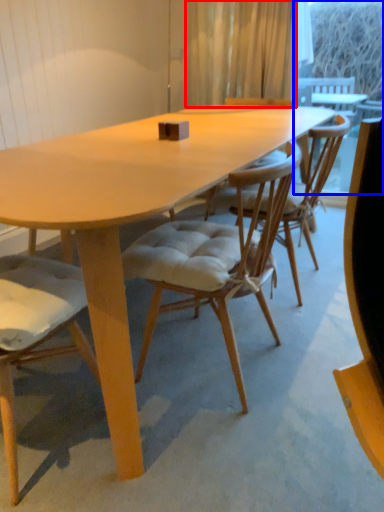
Question: Among these objects, which one is nearest to the camera, curtain (highlighted by a red box) or window screen (highlighted by a blue box)?

Choices:
 (A) curtain
 (B) window screen

Answer: (A)